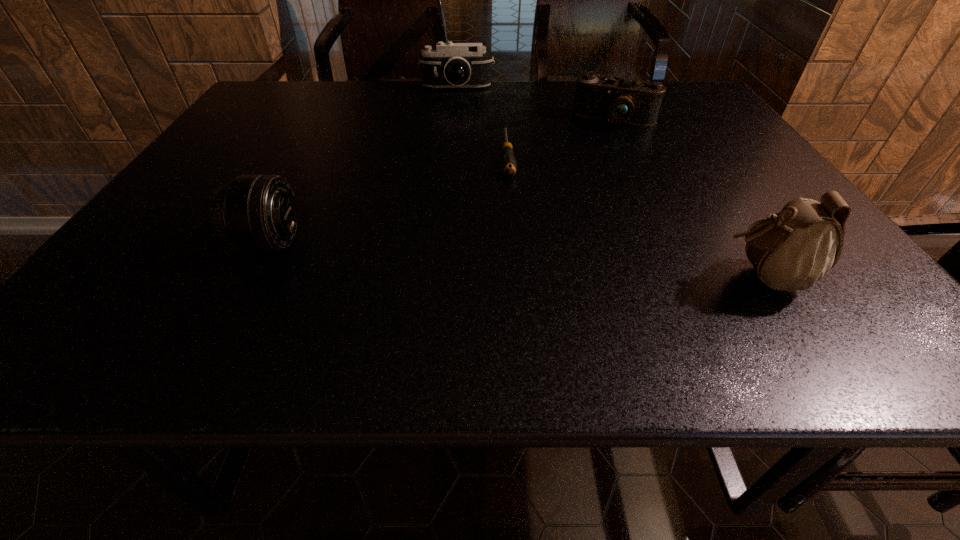
Where is `vacant region at the far right corner of the desktop`? vacant region at the far right corner of the desktop is located at coordinates (672, 114).

This screenshot has height=540, width=960. In the image, there is a desktop. Identify the location of vacant region at the near right corner. (853, 281).

Find the location of a particular element. The width and height of the screenshot is (960, 540). free point between the third object from left to right and the nearer camera is located at coordinates pos(561,137).

I want to click on blank region between the pouch and the second object from left to right, so click(610, 183).

Identify the location of free space between the farthest object and the telephoto lens. (363, 165).

Find the location of a particular element. The width and height of the screenshot is (960, 540). free space between the telephoto lens and the screwdriver is located at coordinates (388, 198).

The width and height of the screenshot is (960, 540). I want to click on vacant space that is in between the leftmost object and the third farthest object, so click(388, 198).

This screenshot has width=960, height=540. What are the coordinates of `free space that is in between the third object from left to right and the right camera` in the screenshot? It's located at (561, 137).

Locate an element on the screen. Image resolution: width=960 pixels, height=540 pixels. free area in between the left camera and the pouch is located at coordinates (610, 183).

Where is `free spot between the telephoto lens and the screwdriver`? This screenshot has width=960, height=540. free spot between the telephoto lens and the screwdriver is located at coordinates coord(388,198).